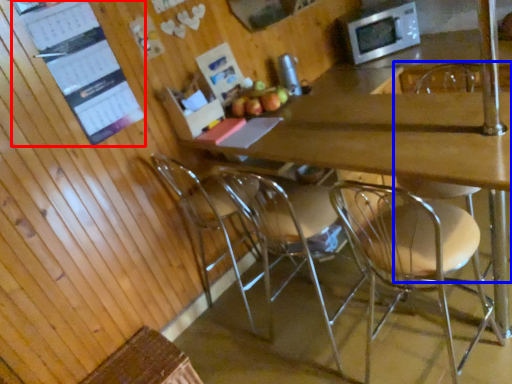
Question: Which of the following is the farthest to the observer, bulletin board (highlighted by a red box) or chair (highlighted by a blue box)?

Choices:
 (A) bulletin board
 (B) chair

Answer: (A)